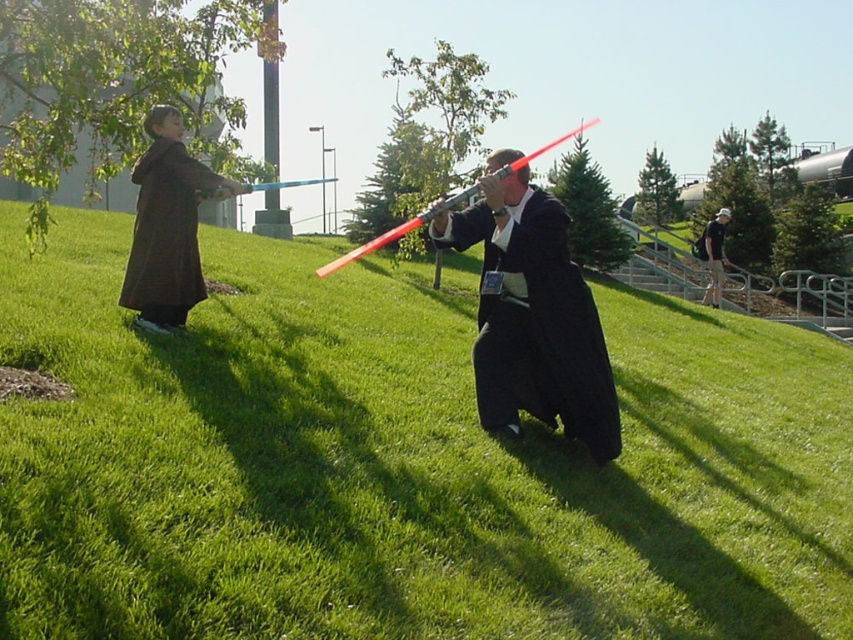
You are a drone operator trying to capture the best aerial shot of the lightsaber duel scene. The drone is currently hovering at point coordinates of 0.6, 0.5. You need to adjust the drone to focus on the green grassy area at center. Should you move the drone north or south to align with the green grassy at center?

The green grassy at center is located at coordinates point (401,464). The drone is at (426,384). To align with the grassy area, the drone should move north because the grassy area is north of the current position.